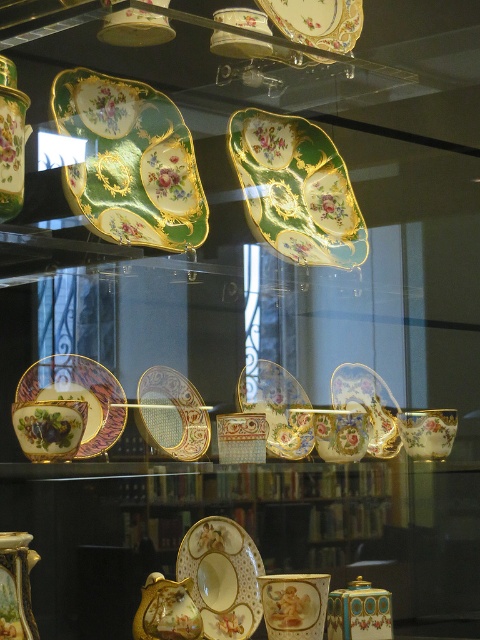
How far apart are gold-gilded porcelain plate at lower left and porcelain vase at lower left?

The distance of gold-gilded porcelain plate at lower left from porcelain vase at lower left is 11.35 inches.

Describe the element at coordinates (80, 396) in the screenshot. The height and width of the screenshot is (640, 480). I see `gold-gilded porcelain plate at lower left` at that location.

The width and height of the screenshot is (480, 640). Identify the location of gold-gilded porcelain plate at lower left. (80, 396).

Between porcelain plate at center and matte gold vase at lower left, which one is positioned higher?

Positioned higher is porcelain plate at center.

Who is positioned more to the right, porcelain plate at center or matte gold vase at lower left?

From the viewer's perspective, porcelain plate at center appears more on the right side.

The height and width of the screenshot is (640, 480). I want to click on porcelain plate at center, so click(222, 577).

This screenshot has width=480, height=640. In order to click on porcelain plate at center in this screenshot , I will do `click(222, 577)`.

Does green porcelain plate at upper left appear on the right side of porcelain vase at center?

In fact, green porcelain plate at upper left is to the left of porcelain vase at center.

Can you confirm if green porcelain plate at upper left is bigger than porcelain vase at center?

Yes.

Between point (104, 205) and point (264, 602), which one is positioned behind?

Positioned behind is point (264, 602).

This screenshot has height=640, width=480. Find the location of `green porcelain plate at upper left`. green porcelain plate at upper left is located at coordinates (131, 161).